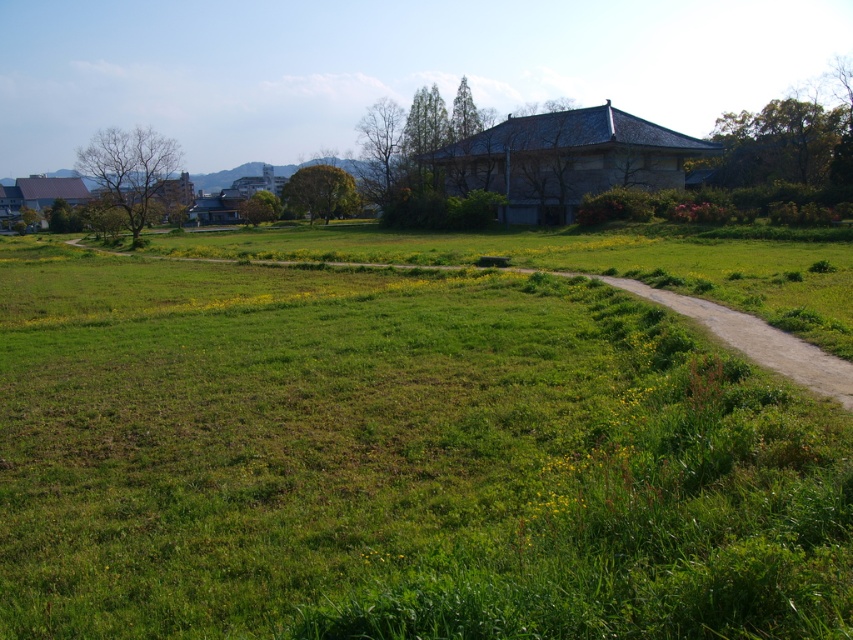
Question: Which object appears closest to the camera in this image?

Choices:
 (A) green grassy field at center
 (B) green grassy trail at center

Answer: (A)

Question: Which point is farther from the camera taking this photo?

Choices:
 (A) (483, 371)
 (B) (704, 321)

Answer: (B)

Question: Among these points, which one is farthest from the camera?

Choices:
 (A) tap(775, 337)
 (B) tap(343, 436)

Answer: (A)

Question: Does green grassy field at center appear on the left side of green grassy trail at center?

Choices:
 (A) yes
 (B) no

Answer: (A)

Question: Does green grassy field at center have a larger size compared to green grassy trail at center?

Choices:
 (A) yes
 (B) no

Answer: (A)

Question: Does green grassy field at center appear under green grassy trail at center?

Choices:
 (A) no
 (B) yes

Answer: (B)